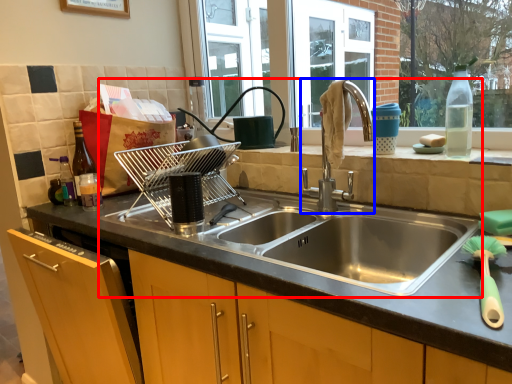
Question: Which object is closer to the camera taking this photo, sink (highlighted by a red box) or tap (highlighted by a blue box)?

Choices:
 (A) sink
 (B) tap

Answer: (A)